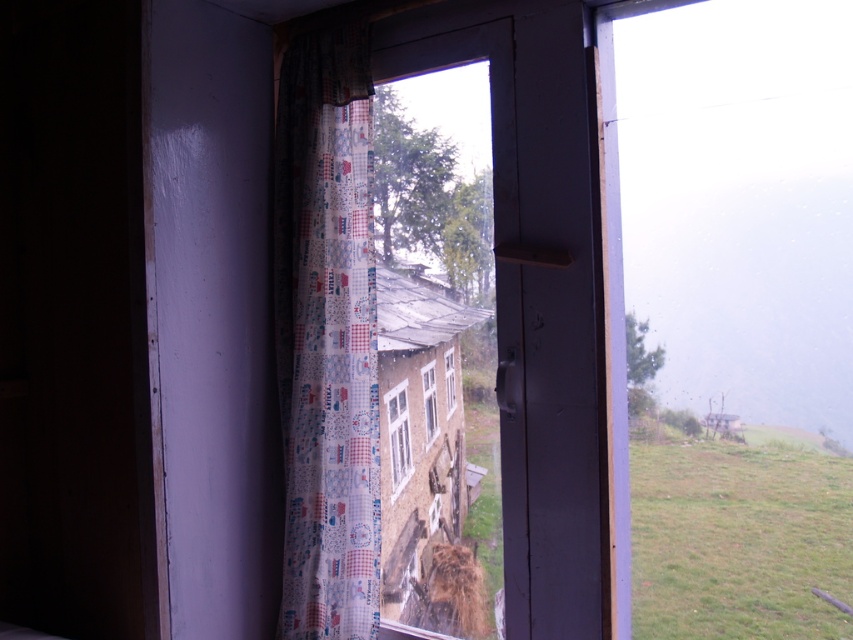
Question: Does printed fabric curtain at left lie in front of transparent plastic window at center?

Choices:
 (A) yes
 (B) no

Answer: (A)

Question: Among these points, which one is farthest from the camera?

Choices:
 (A) (445, 396)
 (B) (366, 76)

Answer: (A)

Question: Which point is closer to the camera?

Choices:
 (A) clear glass window at center
 (B) white plastic window at center
 (C) transparent plastic window at center

Answer: (B)

Question: Is the position of printed fabric curtain at left more distant than that of clear glass window at center?

Choices:
 (A) no
 (B) yes

Answer: (A)

Question: Among these points, which one is farthest from the camera?

Choices:
 (A) (302, 566)
 (B) (393, 388)

Answer: (B)

Question: Can you confirm if clear glass window at center is positioned below transparent plastic window at center?

Choices:
 (A) yes
 (B) no

Answer: (A)